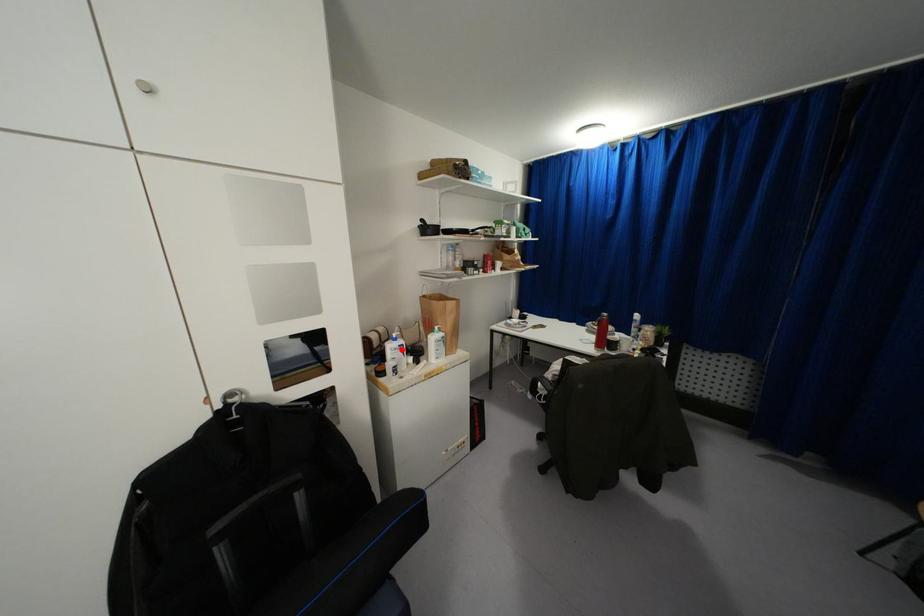
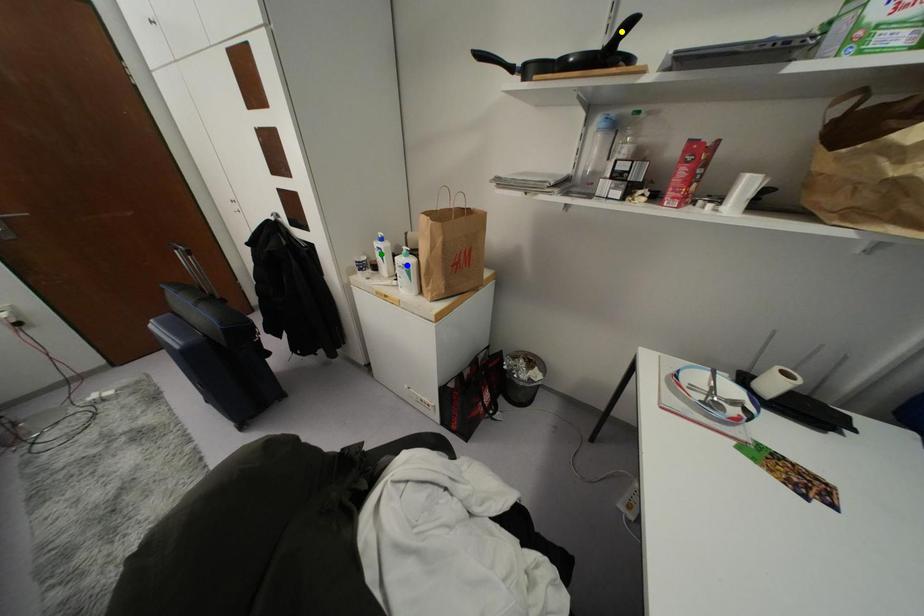
Question: I am providing you with two images of the same scene from different viewpoints. A red point is marked on the first image. You are given multiple points on the second image. Which mark in image 2 goes with the point in image 1?

Choices:
 (A) blue point
 (B) green point
 (C) yellow point

Answer: (B)